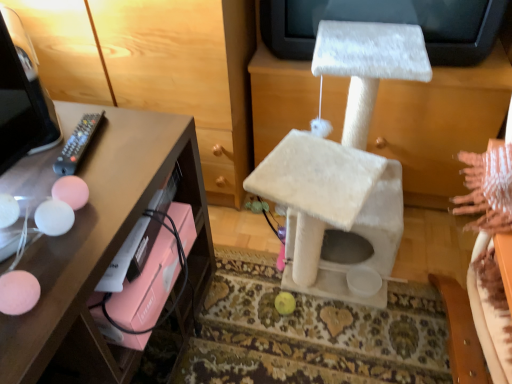
Question: Should I look upward or downward to see white furry cat tree at center?

Choices:
 (A) up
 (B) down

Answer: (A)

Question: Would you say white furry cat tree at center is part of matte pink drawer at left's contents?

Choices:
 (A) no
 (B) yes

Answer: (A)

Question: From the image's perspective, would you say matte pink drawer at left is shown under white furry cat tree at center?

Choices:
 (A) yes
 (B) no

Answer: (B)

Question: From the image's perspective, is matte pink drawer at left on top of white furry cat tree at center?

Choices:
 (A) yes
 (B) no

Answer: (A)

Question: Is the depth of matte pink drawer at left greater than that of white furry cat tree at center?

Choices:
 (A) no
 (B) yes

Answer: (B)

Question: Is matte pink drawer at left far away from white furry cat tree at center?

Choices:
 (A) yes
 (B) no

Answer: (B)

Question: Does matte pink drawer at left have a larger size compared to white furry cat tree at center?

Choices:
 (A) yes
 (B) no

Answer: (A)

Question: Can we say white furry cat tree at center lies outside matte pink drawer at left?

Choices:
 (A) no
 (B) yes

Answer: (B)

Question: Is white furry cat tree at center smaller than matte pink drawer at left?

Choices:
 (A) no
 (B) yes

Answer: (B)

Question: From a real-world perspective, is white furry cat tree at center on top of matte pink drawer at left?

Choices:
 (A) yes
 (B) no

Answer: (B)

Question: From a real-world perspective, is white furry cat tree at center positioned under matte pink drawer at left based on gravity?

Choices:
 (A) no
 (B) yes

Answer: (B)

Question: Can you confirm if white furry cat tree at center is taller than matte pink drawer at left?

Choices:
 (A) yes
 (B) no

Answer: (B)

Question: Would you say white furry cat tree at center contains matte pink drawer at left?

Choices:
 (A) no
 (B) yes

Answer: (A)

Question: From the image's perspective, is black plastic remote at left below white furry cat tree at center?

Choices:
 (A) no
 (B) yes

Answer: (A)